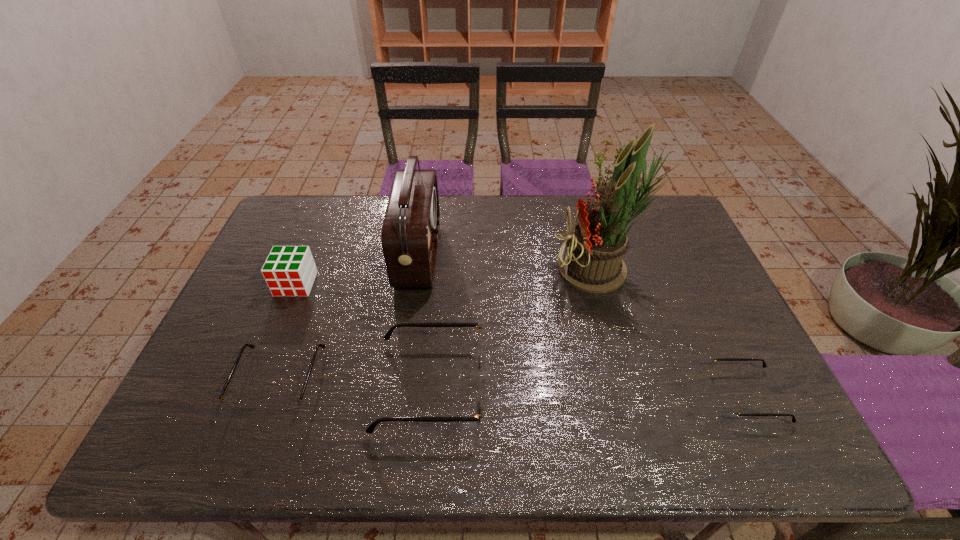
If equal spacing is the goal by inserting an additional spectacles among them, please point out a vacant space for this new spectacles. Please provide its 2D coordinates. Your answer should be formatted as a tuple, i.e. [(x, y)], where the tuple contains the x and y coordinates of a point satisfying the conditions above.

[(588, 390)]